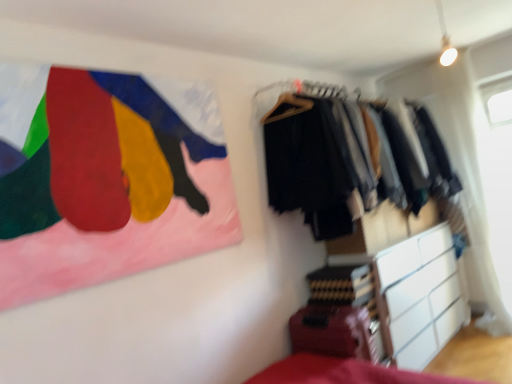
The width and height of the screenshot is (512, 384). Identify the location of vacant area on top of painted fabric flag at upper left (from a real-world perspective). (101, 64).